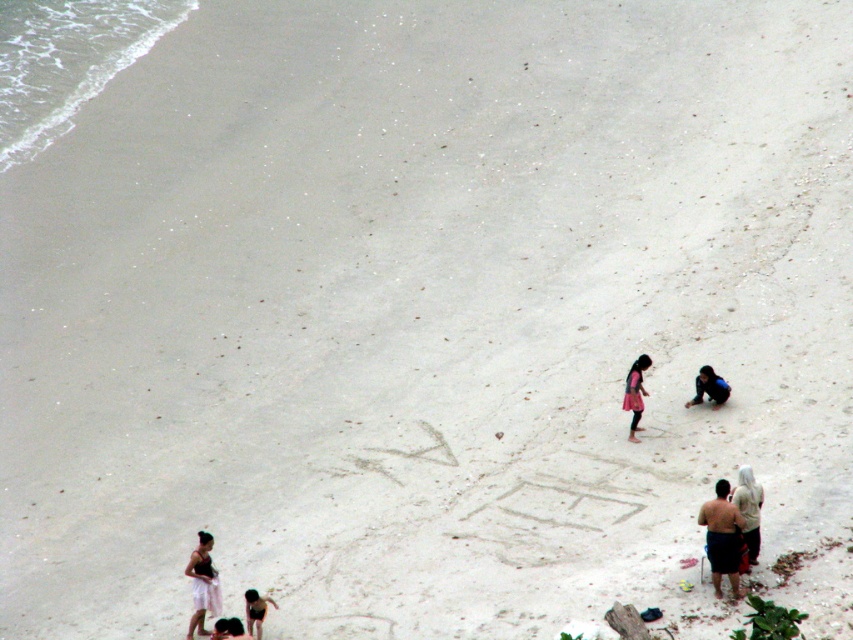
Which is more to the right, pink fabric dress at center or smooth skin person at lower left?

Positioned to the right is pink fabric dress at center.

Who is more distant from viewer, (631, 392) or (221, 624)?

Point (631, 392)

At what (x,y) coordinates should I click in order to perform the action: click on pink fabric dress at center. Please return your answer as a coordinate pair (x, y). Image resolution: width=853 pixels, height=640 pixels. Looking at the image, I should click on (635, 392).

You are a GUI agent. You are given a task and a screenshot of the screen. Output one action in this format:
    pyautogui.click(x=<x>, y=<y>)
    Task: Click on the pink fabric dress at center
    This screenshot has height=640, width=853.
    Given the screenshot: What is the action you would take?
    pyautogui.click(x=635, y=392)

Is white cotton towel at lower left thinner than light beige cotton shirt at lower right?

Correct, white cotton towel at lower left's width is less than light beige cotton shirt at lower right's.

Who is shorter, white cotton towel at lower left or light beige cotton shirt at lower right?

light beige cotton shirt at lower right

Does point (215, 570) come closer to viewer compared to point (749, 532)?

Yes, point (215, 570) is in front of point (749, 532).

At what (x,y) coordinates should I click in order to perform the action: click on white cotton towel at lower left. Please return your answer as a coordinate pair (x, y). Looking at the image, I should click on pyautogui.click(x=202, y=584).

Is pink fabric dress at center positioned in front of dark brown hair at lower center?

No, pink fabric dress at center is further to the viewer.

Which is behind, point (648, 362) or point (233, 637)?

Positioned behind is point (648, 362).

You are a GUI agent. You are given a task and a screenshot of the screen. Output one action in this format:
    pyautogui.click(x=<x>, y=<y>)
    Task: Click on the pink fabric dress at center
    This screenshot has height=640, width=853.
    Given the screenshot: What is the action you would take?
    pyautogui.click(x=635, y=392)